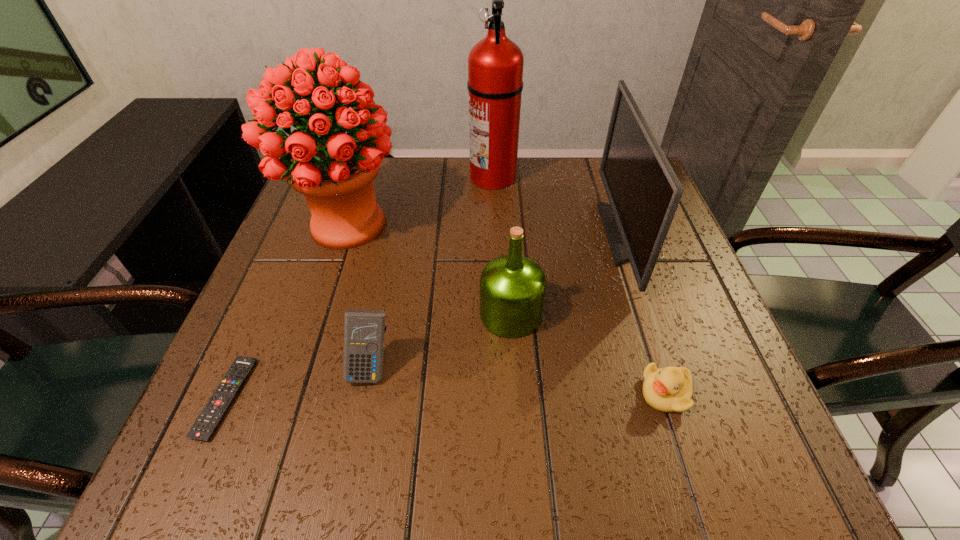
Locate an element on the screen. This screenshot has height=540, width=960. object located in the far right corner section of the desktop is located at coordinates (644, 192).

In the image, there is a desktop. At what (x,y) coordinates should I click in order to perform the action: click on vacant space at the far edge. Please return your answer as a coordinate pair (x, y). Image resolution: width=960 pixels, height=540 pixels. Looking at the image, I should click on (540, 161).

Identify the location of vacant space at the left edge of the desktop. This screenshot has height=540, width=960. (324, 298).

Image resolution: width=960 pixels, height=540 pixels. Find the location of `vacant position at the right edge of the desktop`. vacant position at the right edge of the desktop is located at coordinates (636, 294).

Image resolution: width=960 pixels, height=540 pixels. I want to click on vacant region at the near right corner of the desktop, so click(736, 424).

I want to click on free space that is in between the fire extinguisher and the remote control, so click(x=359, y=287).

Locate an element on the screen. Image resolution: width=960 pixels, height=540 pixels. free space between the fifth shortest object and the fourth shortest object is located at coordinates (567, 274).

Locate an element on the screen. empty space that is in between the fourth tallest object and the duckling is located at coordinates (588, 354).

Identify the location of vacant space that is in between the fire extinguisher and the bouquet. (420, 200).

The height and width of the screenshot is (540, 960). In order to click on free spot between the fire extinguisher and the second shortest object in this screenshot , I will do `click(579, 285)`.